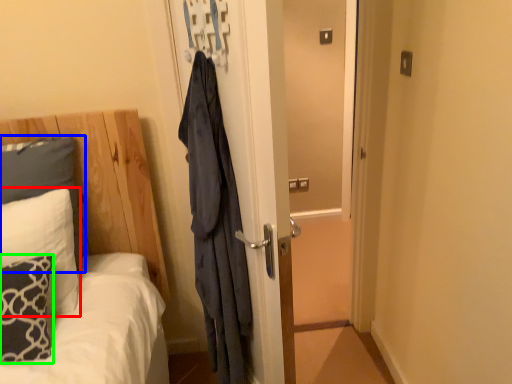
Question: Based on their relative distances, which object is nearer to pillow (highlighted by a red box)? Choose from pillow (highlighted by a blue box) and pillow (highlighted by a green box).

Choices:
 (A) pillow
 (B) pillow

Answer: (B)